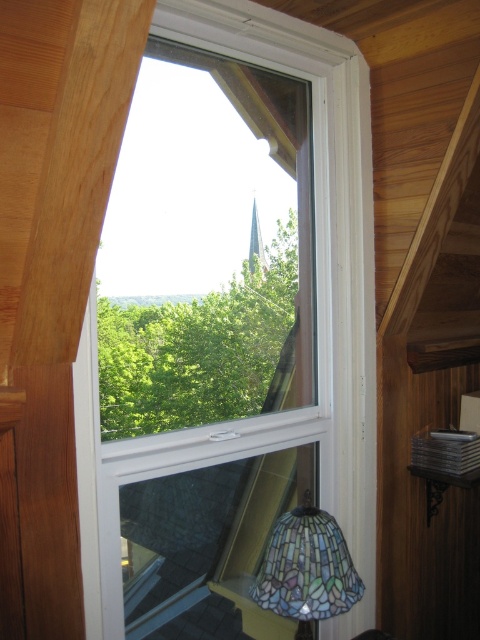
Question: Which point is farther from the camera taking this photo?

Choices:
 (A) (311, 371)
 (B) (278, 540)

Answer: (A)

Question: Can you confirm if clear glass window at center is thinner than stained glass lampshade at lower right?

Choices:
 (A) no
 (B) yes

Answer: (A)

Question: Is clear glass window at center to the right of stained glass lampshade at lower right from the viewer's perspective?

Choices:
 (A) yes
 (B) no

Answer: (B)

Question: Which of the following is the closest to the observer?

Choices:
 (A) (279, 600)
 (B) (227, 534)

Answer: (A)

Question: Is clear glass window at center behind stained glass lampshade at lower right?

Choices:
 (A) yes
 (B) no

Answer: (B)

Question: Which object appears closest to the camera in this image?

Choices:
 (A) stained glass lampshade at lower right
 (B) clear glass window at center

Answer: (B)